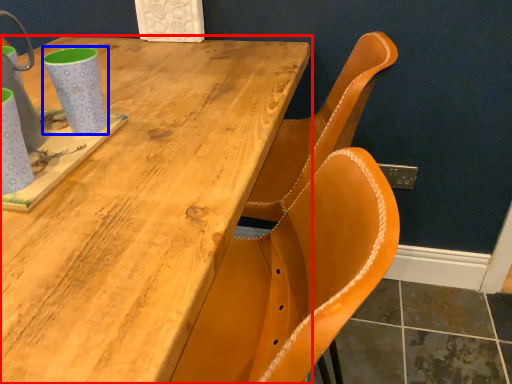
Question: Which point is closer to the camera, table (highlighted by a red box) or mug (highlighted by a blue box)?

Choices:
 (A) table
 (B) mug

Answer: (A)